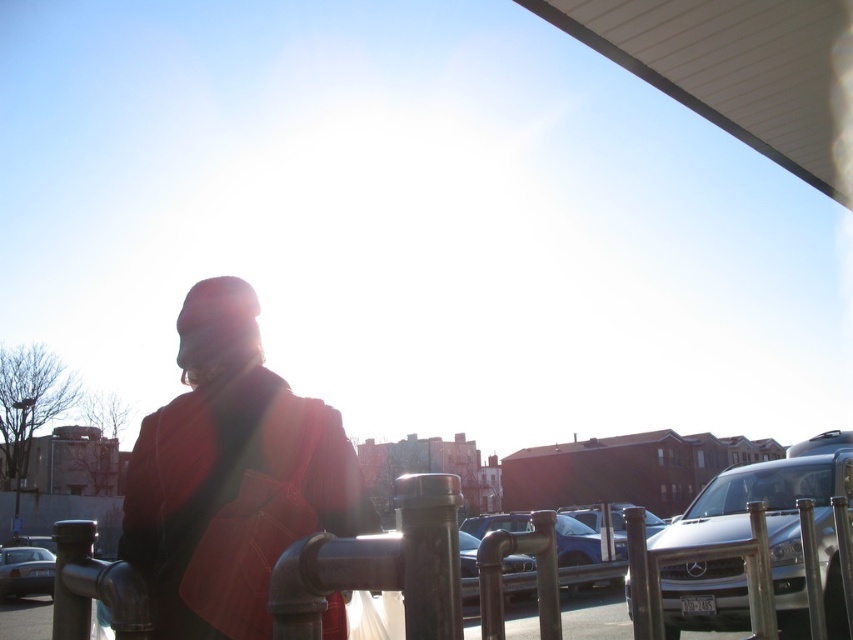
You are standing at the point labeled point (234, 586) and want to walk to the parking lot. Which direction should you move relative to the point labeled point (805, 472)?

You should move towards the direction away from the point labeled point (805, 472) because point (234, 586) is in front of it.

You are a pedestrian trying to locate the matte red coat at center in a parking lot scene. Given the coordinates provided in the description, can you determine its position relative to the metal railing where the person is standing?

The matte red coat at center is located at point 0.744 on the x axis and 0.272 on the y axis. Since the person is standing near the metal railing, which is likely at a lower coordinate on the x or y axis, the coat is positioned further away from the railing in the parking lot.